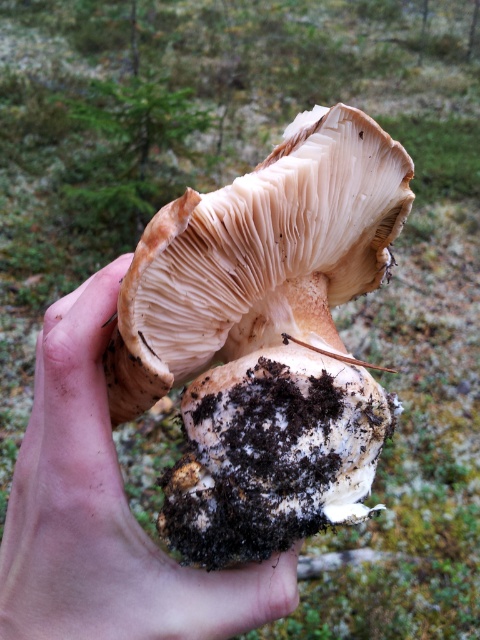
Can you confirm if brown fibrous mushroom at center is positioned above smooth beige mushroom at center?

Yes, brown fibrous mushroom at center is above smooth beige mushroom at center.

Between brown fibrous mushroom at center and smooth beige mushroom at center, which one appears on the right side from the viewer's perspective?

brown fibrous mushroom at center is more to the right.

What do you see at coordinates (264, 339) in the screenshot? The height and width of the screenshot is (640, 480). I see `brown fibrous mushroom at center` at bounding box center [264, 339].

Image resolution: width=480 pixels, height=640 pixels. What are the coordinates of `brown fibrous mushroom at center` in the screenshot? It's located at (264, 339).